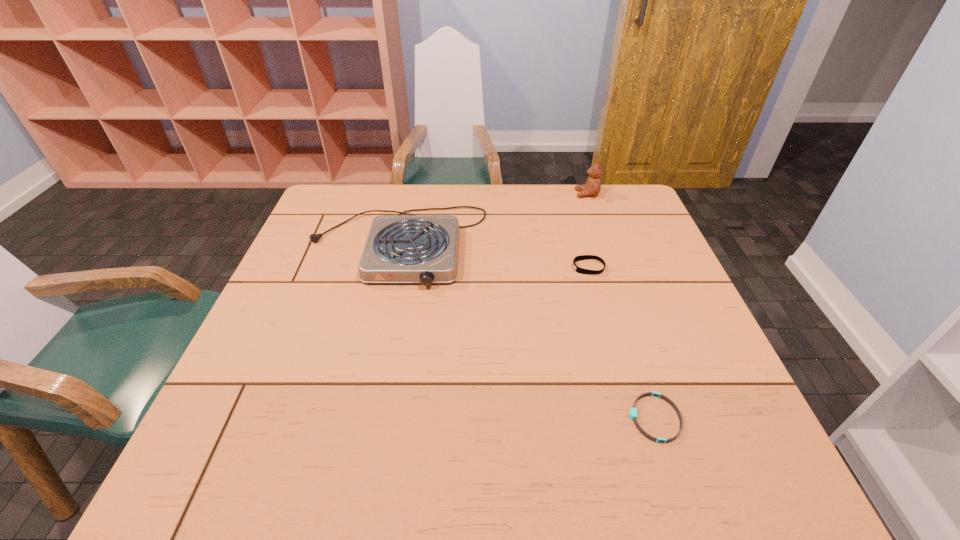
Find the location of a particular element. This screenshot has height=540, width=960. vacant space located on the face of the tallest object is located at coordinates click(x=502, y=194).

Find the location of a particular element. free space located 0.110m with a retractable cable on the side of the third shortest object is located at coordinates (380, 325).

Find the location of a particular element. vacant position located 0.160m on the display of the taller wristband is located at coordinates (513, 267).

You are a GUI agent. You are given a task and a screenshot of the screen. Output one action in this format:
    pyautogui.click(x=<x>, y=<y>)
    Task: Click on the free location located on the display of the taller wristband
    
    Given the screenshot: What is the action you would take?
    pyautogui.click(x=501, y=267)

The width and height of the screenshot is (960, 540). Find the location of `free location located 0.110m on the display of the taller wristband`. free location located 0.110m on the display of the taller wristband is located at coordinates click(x=531, y=267).

Find the location of a particular element. Image resolution: width=960 pixels, height=540 pixels. vacant space located 0.060m on the buckle of the shorter wristband is located at coordinates (598, 418).

Find the location of a particular element. This screenshot has height=540, width=960. vacant area situated on the buckle of the shorter wristband is located at coordinates (525, 418).

Find the location of a particular element. Image resolution: width=960 pixels, height=540 pixels. free space located 0.090m on the buckle of the shorter wristband is located at coordinates (583, 418).

You are a GUI agent. You are given a task and a screenshot of the screen. Output one action in this format:
    pyautogui.click(x=<x>, y=<y>)
    Task: Click on the teddy bear present at the far edge
    The image size is (960, 540).
    Given the screenshot: What is the action you would take?
    pyautogui.click(x=592, y=187)

Identify the location of hotplate that is at the far edge. This screenshot has width=960, height=540. (408, 248).